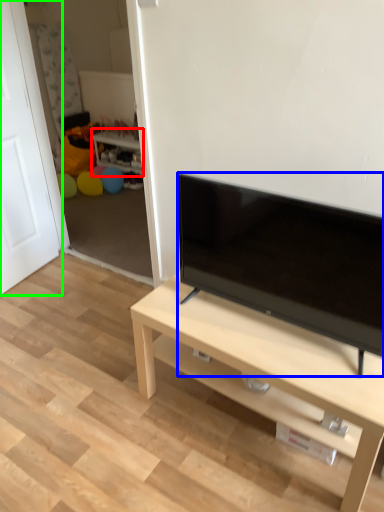
Question: Which object is the farthest from side table (highlighted by a red box)? Choose among these: television (highlighted by a blue box) or door (highlighted by a green box).

Choices:
 (A) television
 (B) door

Answer: (A)